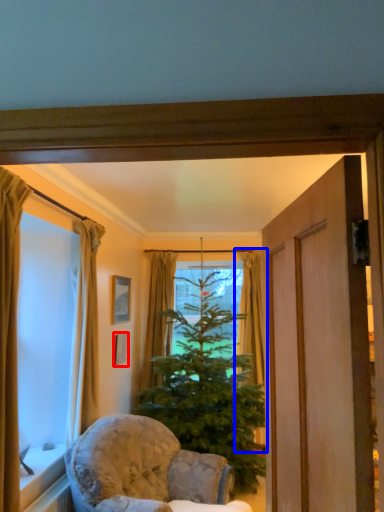
Question: Which object is further to the camera taking this photo, picture frame (highlighted by a red box) or curtain (highlighted by a blue box)?

Choices:
 (A) picture frame
 (B) curtain

Answer: (B)